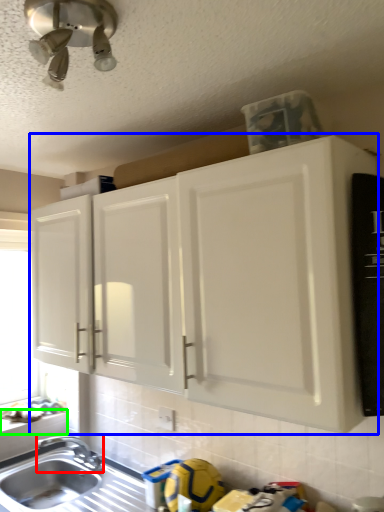
Question: Which is farther away from tap (highlighted by a red box)? cabinetry (highlighted by a blue box) or window sill (highlighted by a green box)?

Choices:
 (A) cabinetry
 (B) window sill

Answer: (A)